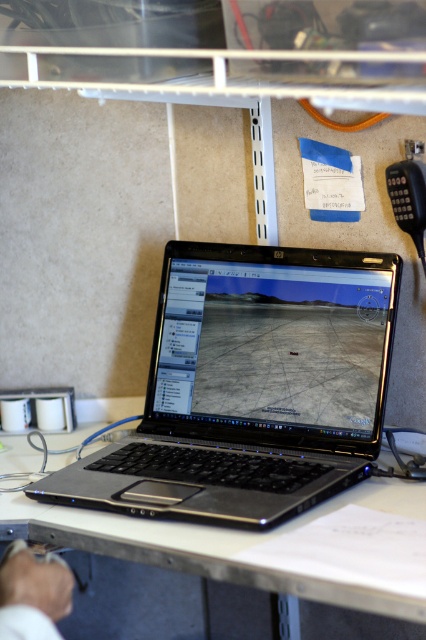
You are trying to determine if the satin black laptop at center can fit into a storage box designed for items narrower than the white fabric hand at lower left. Based on their widths, will the laptop fit?

The satin black laptop at center is wider than the white fabric hand at lower left, so it will not fit into a storage box designed for items narrower than the white fabric hand at lower left.

You are standing in front of the workspace setup. The white plastic table at center is represented by point [219,545]. Where is the point located in relation to the laptop?

The white plastic table at center is represented by point [219,545], which is the center of the table. Since the laptop is placed on the desk, the point is likely located under the laptop.

You are organizing a desk and need to place a new monitor between the satin black laptop at center and the white plastic table at center. Which object should the monitor be placed closer to in order to maintain proper desk organization?

The monitor should be placed closer to the satin black laptop at center since it is closer to the viewer than the white plastic table at center, ensuring better accessibility and organization.